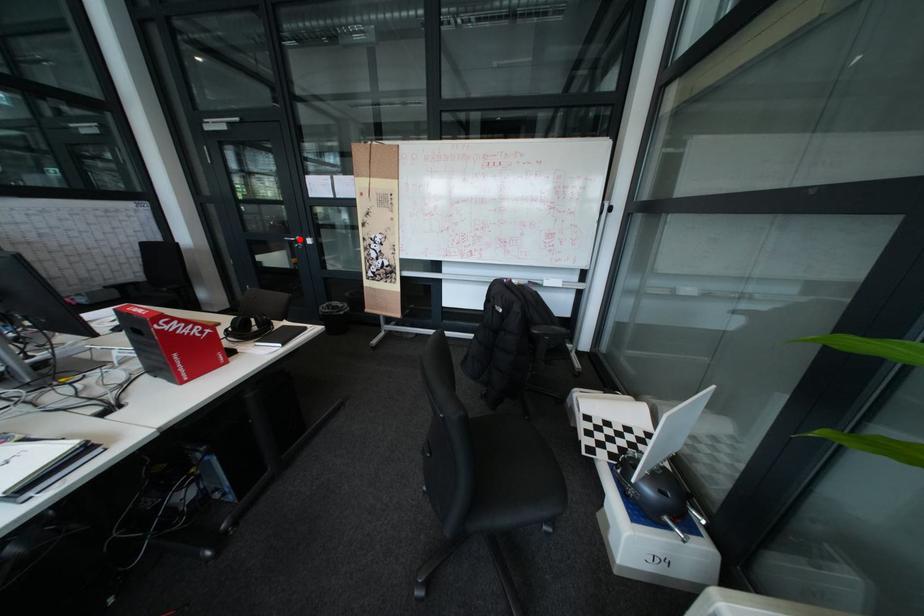
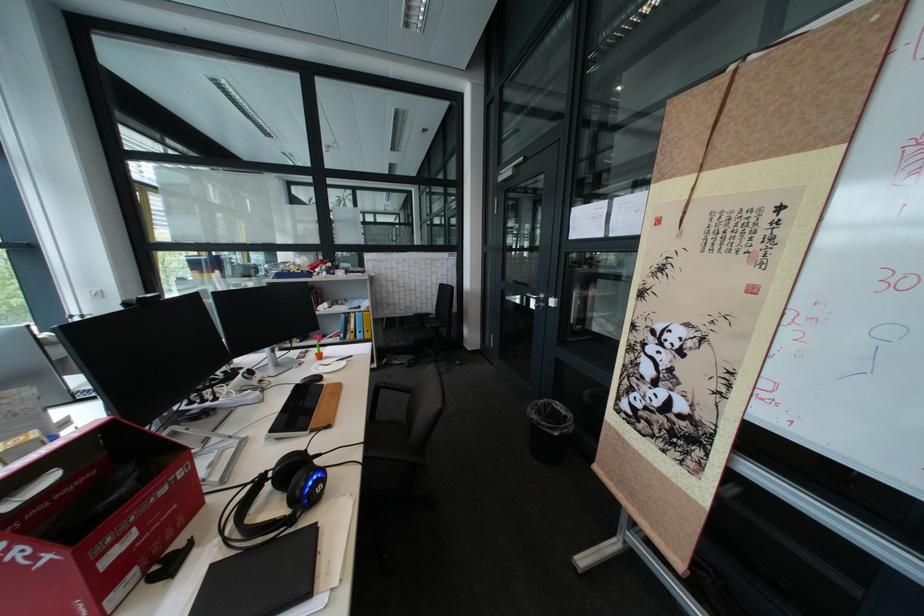
Locate, in the second image, the point that corresponds to the highlighted location in the first image.

(541, 294)